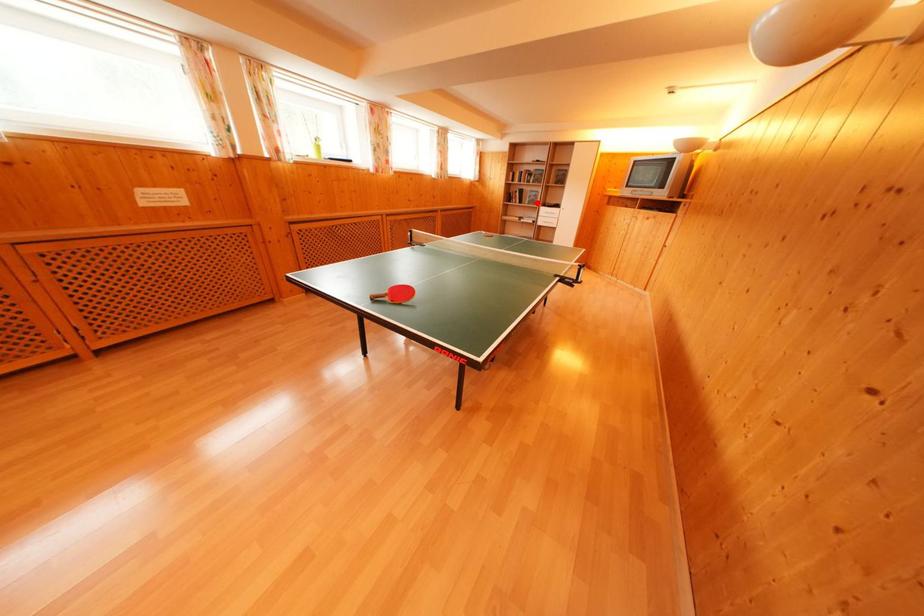
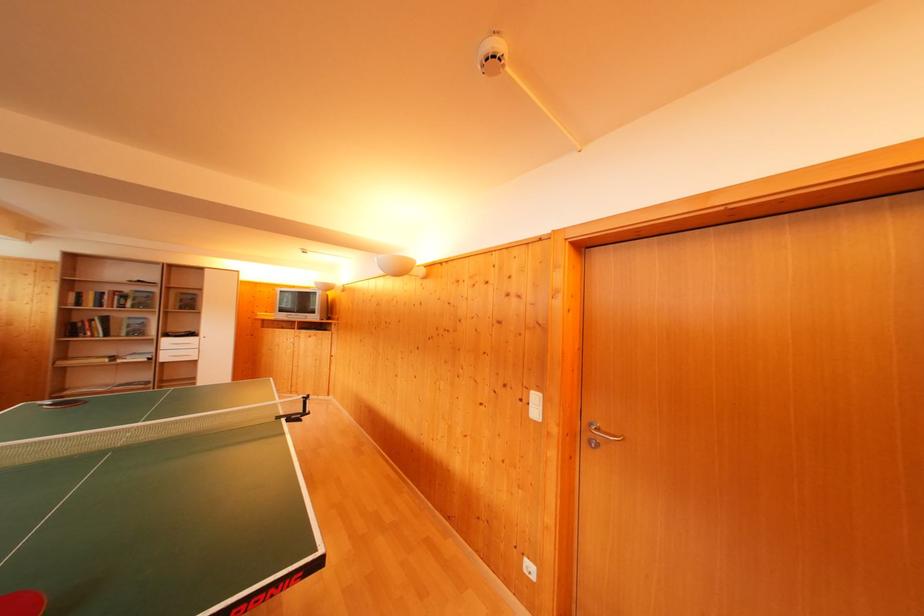
Locate, in the second image, the point that corresponds to the highlighted location in the first image.

(140, 331)